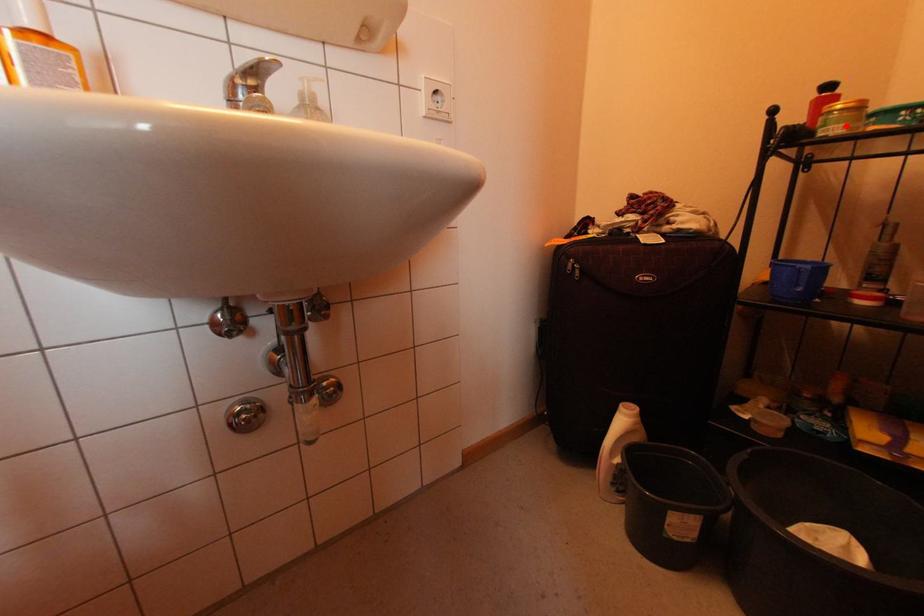
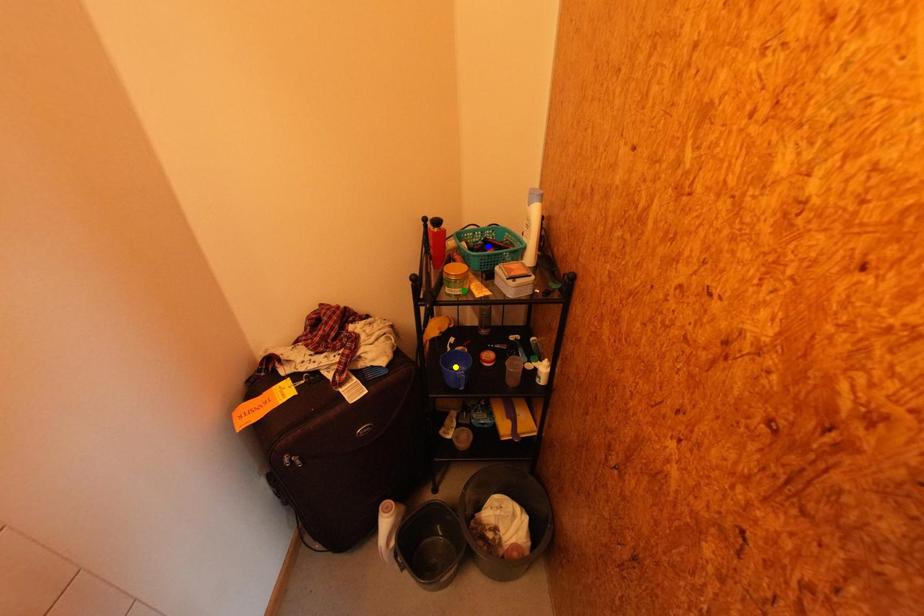
Question: I am providing you with two images of the same scene from different viewpoints. A red point is marked on the first image. You are given multiple points on the second image. Which spot in image 2 lines up with the point in image 1?

Choices:
 (A) yellow point
 (B) blue point
 (C) green point

Answer: (C)